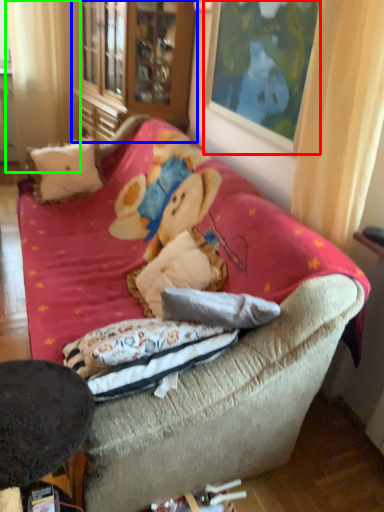
Question: Considering the real-world distances, which object is closest to picture frame (highlighted by a red box)? armoire (highlighted by a blue box) or curtain (highlighted by a green box).

Choices:
 (A) armoire
 (B) curtain

Answer: (A)